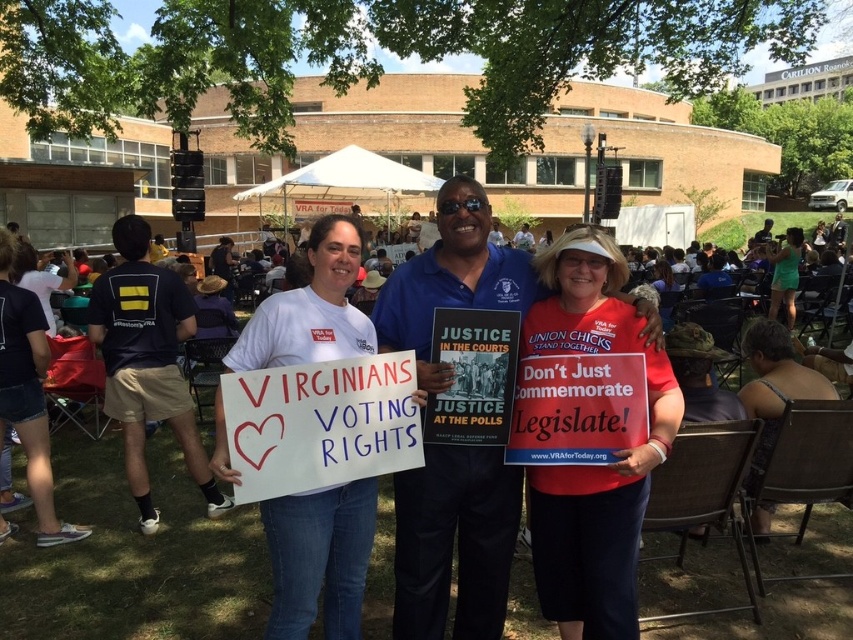
Question: Can you confirm if red matte sign at center is positioned above white paper sign at center?

Choices:
 (A) no
 (B) yes

Answer: (A)

Question: Can you confirm if red matte sign at center is positioned above white paper sign at center?

Choices:
 (A) no
 (B) yes

Answer: (A)

Question: Does red matte sign at center have a greater width compared to white paper sign at center?

Choices:
 (A) yes
 (B) no

Answer: (A)